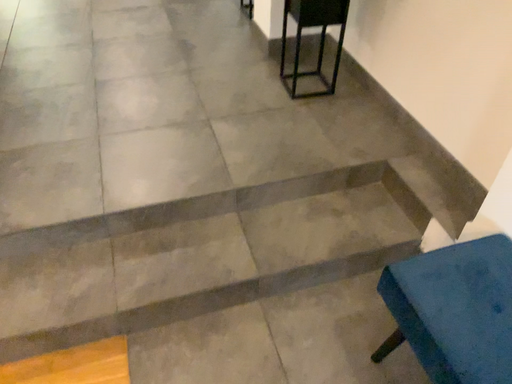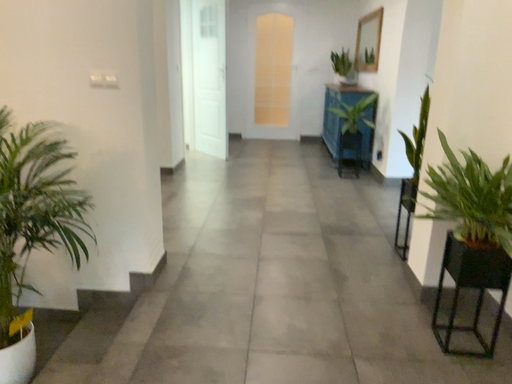
Question: Which way did the camera rotate in the video?

Choices:
 (A) rotated upward
 (B) rotated downward

Answer: (A)